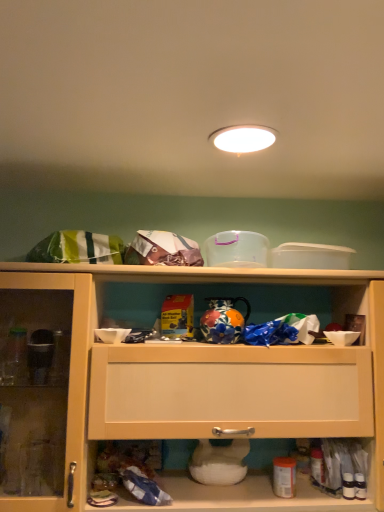
Question: Is the depth of matte wood cabinet at center greater than that of white glossy light fixture at upper center?

Choices:
 (A) no
 (B) yes

Answer: (B)

Question: Is matte wood cabinet at center far away from white glossy light fixture at upper center?

Choices:
 (A) yes
 (B) no

Answer: (B)

Question: Can you confirm if matte wood cabinet at center is smaller than white glossy light fixture at upper center?

Choices:
 (A) yes
 (B) no

Answer: (B)

Question: Does matte wood cabinet at center have a greater height compared to white glossy light fixture at upper center?

Choices:
 (A) yes
 (B) no

Answer: (A)

Question: Is matte wood cabinet at center shorter than white glossy light fixture at upper center?

Choices:
 (A) no
 (B) yes

Answer: (A)

Question: From the image's perspective, is matte wood cabinet at center over white glossy light fixture at upper center?

Choices:
 (A) no
 (B) yes

Answer: (A)

Question: Are white glossy light fixture at upper center and matte wood cabinet at center located far from each other?

Choices:
 (A) yes
 (B) no

Answer: (B)

Question: Is white glossy light fixture at upper center outside of matte wood cabinet at center?

Choices:
 (A) yes
 (B) no

Answer: (A)

Question: Does white glossy light fixture at upper center come behind matte wood cabinet at center?

Choices:
 (A) no
 (B) yes

Answer: (A)

Question: Is matte wood cabinet at center completely or partially inside white glossy light fixture at upper center?

Choices:
 (A) yes
 (B) no

Answer: (B)

Question: Considering the relative sizes of white glossy light fixture at upper center and matte wood cabinet at center in the image provided, is white glossy light fixture at upper center thinner than matte wood cabinet at center?

Choices:
 (A) no
 (B) yes

Answer: (B)

Question: Is white glossy light fixture at upper center to the left of matte wood cabinet at center from the viewer's perspective?

Choices:
 (A) no
 (B) yes

Answer: (A)

Question: Based on their sizes in the image, would you say white glossy light fixture at upper center is bigger or smaller than matte wood cabinet at center?

Choices:
 (A) small
 (B) big

Answer: (A)